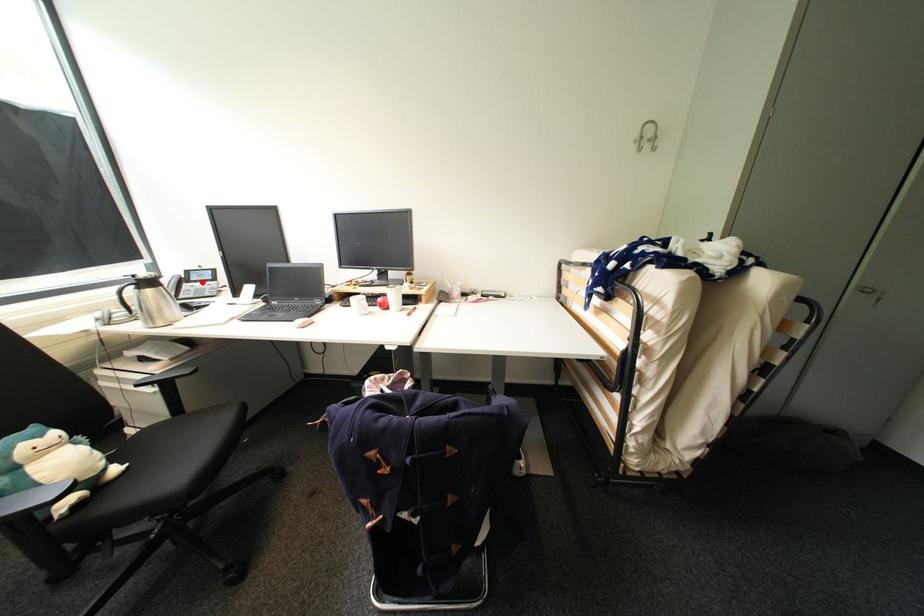
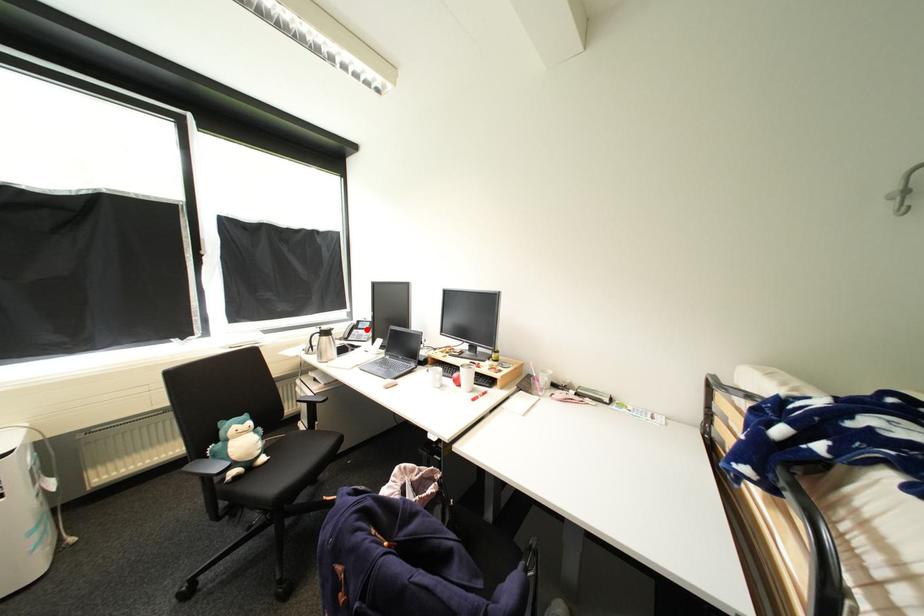
In the scene shown: I am providing you with two images of the same scene from different viewpoints. A red point is marked on the first image and another point is marked on the second image. Is the marked point in image1 the same physical position as the marked point in image2?

Yes